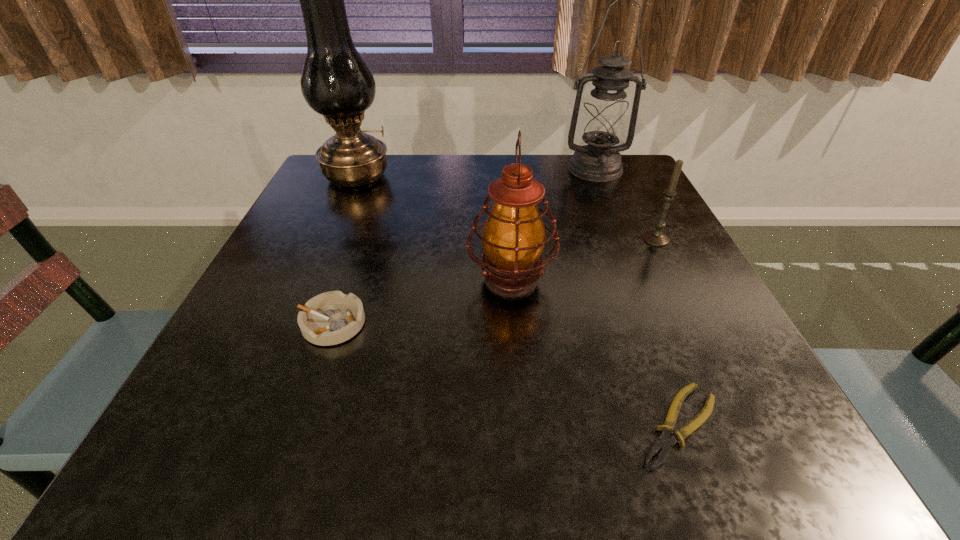
In order to click on pliers that is positioned at the right edge in this screenshot , I will do `click(664, 443)`.

You are a GUI agent. You are given a task and a screenshot of the screen. Output one action in this format:
    pyautogui.click(x=<x>, y=<y>)
    Task: Click on the object located at the far left corner
    
    Given the screenshot: What is the action you would take?
    pyautogui.click(x=336, y=82)

Locate an element on the screen. The width and height of the screenshot is (960, 540). object that is at the far right corner is located at coordinates (604, 118).

Identify the location of object that is positioned at the near right corner. This screenshot has height=540, width=960. 664,443.

You are a GUI agent. You are given a task and a screenshot of the screen. Output one action in this format:
    pyautogui.click(x=<x>, y=<y>)
    Task: Click on the vacant position at the far edge of the desktop
    This screenshot has height=540, width=960.
    Given the screenshot: What is the action you would take?
    pyautogui.click(x=387, y=183)

In the image, there is a desktop. Where is `free space at the near edge`? Image resolution: width=960 pixels, height=540 pixels. free space at the near edge is located at coordinates (416, 448).

Find the location of a particular element. free space at the left edge of the desktop is located at coordinates coord(307,210).

This screenshot has height=540, width=960. What are the coordinates of `free location at the right edge of the desktop` in the screenshot? It's located at (605, 208).

Find the location of `vacant space at the near left corner of the desktop`. vacant space at the near left corner of the desktop is located at coordinates (154, 471).

I want to click on free space at the far right corner of the desktop, so click(608, 199).